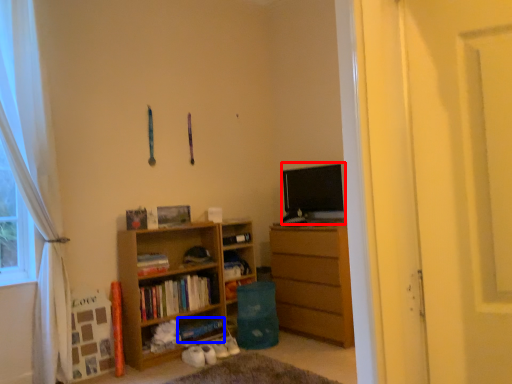
Question: Which object is closer to the camera taking this photo, open (highlighted by a red box) or book (highlighted by a blue box)?

Choices:
 (A) open
 (B) book

Answer: (B)